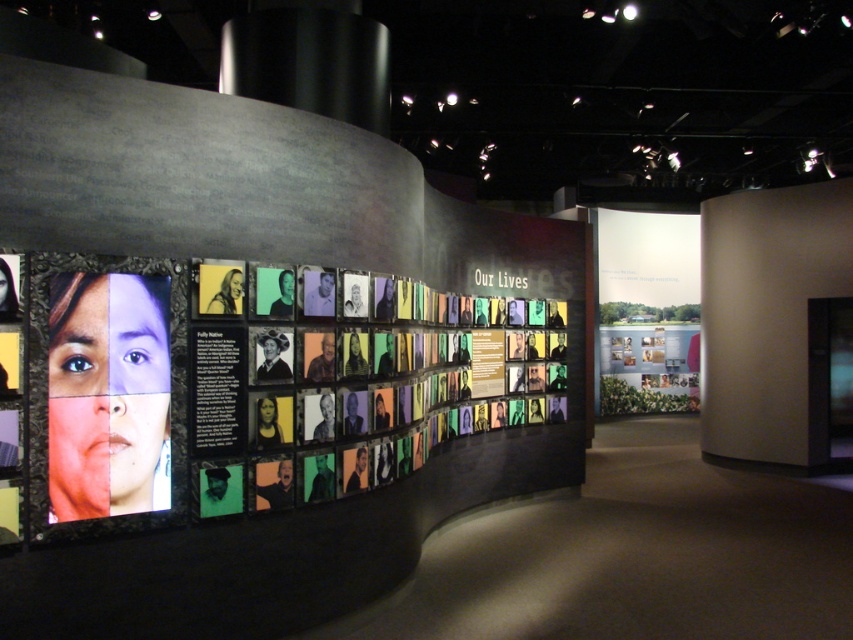
Question: Which of the following is the closest to the observer?

Choices:
 (A) (660, 294)
 (B) (149, 451)

Answer: (B)

Question: From the image, what is the correct spatial relationship of matte plastic poster at left in relation to matte paper poster at center?

Choices:
 (A) above
 (B) below

Answer: (B)

Question: Among these objects, which one is farthest from the camera?

Choices:
 (A) matte paper poster at center
 (B) matte plastic poster at left

Answer: (A)

Question: Is matte plastic poster at left to the right of matte paper poster at center from the viewer's perspective?

Choices:
 (A) yes
 (B) no

Answer: (B)

Question: Which object is farther from the camera taking this photo?

Choices:
 (A) matte paper poster at center
 (B) matte plastic poster at left

Answer: (A)

Question: Does matte plastic poster at left appear on the left side of matte paper poster at center?

Choices:
 (A) yes
 (B) no

Answer: (A)